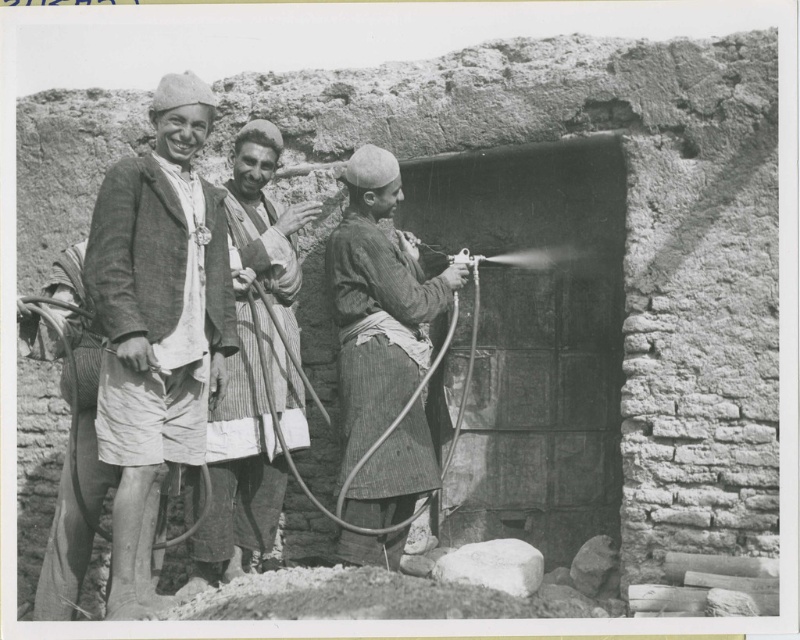
You are standing in front of the rustic mud brick structure and want to move from point A to point B. The points are labeled as point (126, 570) and point (262, 504). Which point should you start from to reach the other without walking backwards?

You should start from point (126, 570) because it is in front of point (262, 504), so moving from the front point to the back point allows you to reach the destination without walking backwards.

In the scene described, there are two objects labeled as the striped fabric spray gun at center and the striped fabric shirt at center. Based on their positions, which one is located to the right of the other?

The striped fabric spray gun at center is to the right of the striped fabric shirt at center.